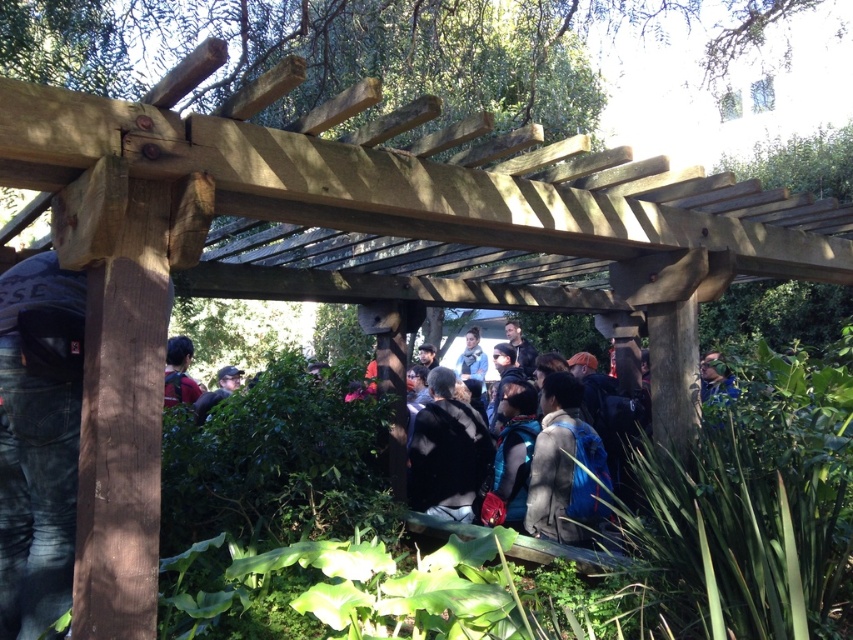
Question: Which point is closer to the camera taking this photo?

Choices:
 (A) (482, 358)
 (B) (236, 385)
 (C) (412, 458)
 (D) (663, 580)

Answer: (D)

Question: Can you confirm if matte black backpack at left is positioned below matte black backpack at center?

Choices:
 (A) no
 (B) yes

Answer: (A)

Question: Can you confirm if matte black backpack at left is positioned above matte black backpack at center?

Choices:
 (A) no
 (B) yes

Answer: (B)

Question: Considering the relative positions of dark green foliage at center and matte black backpack at left in the image provided, where is dark green foliage at center located with respect to matte black backpack at left?

Choices:
 (A) below
 (B) above

Answer: (A)

Question: Which of these objects is positioned farthest from the gray fabric jacket at center?

Choices:
 (A) dark gray fabric jacket at center
 (B) dark green foliage at center
 (C) matte black backpack at center

Answer: (C)

Question: Which point is farther to the camera?

Choices:
 (A) (227, 374)
 (B) (184, 346)
 (C) (460, 364)
 (D) (461, 499)

Answer: (C)